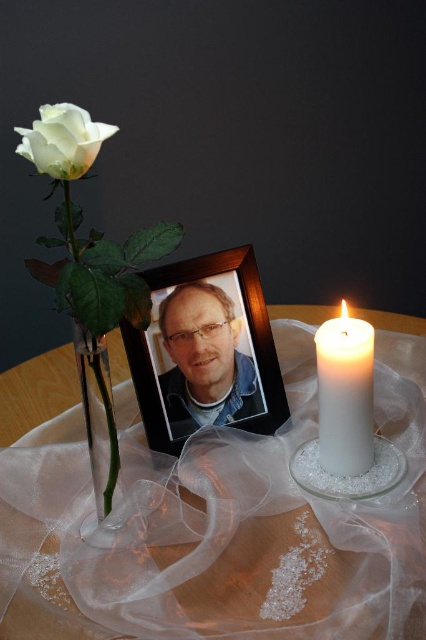
Based on the photo, which is below, white wax candle at right or clear glass vase at left?

clear glass vase at left is lower down.

Between white wax candle at right and clear glass vase at left, which one appears on the left side from the viewer's perspective?

Positioned to the left is clear glass vase at left.

Which is in front, point (330, 461) or point (118, 502)?

Point (118, 502) is in front.

What are the coordinates of `white wax candle at right` in the screenshot? It's located at (345, 394).

Between matte black photo frame at center and white wax candle at right, which one appears on the right side from the viewer's perspective?

Positioned to the right is white wax candle at right.

What do you see at coordinates (204, 360) in the screenshot? The image size is (426, 640). I see `matte black photo frame at center` at bounding box center [204, 360].

Where is `matte black photo frame at center`? The image size is (426, 640). matte black photo frame at center is located at coordinates (204, 360).

Describe the element at coordinates (100, 435) in the screenshot. I see `clear glass vase at left` at that location.

Who is shorter, clear glass vase at left or clear glass candle at center?

clear glass candle at center is shorter.

The width and height of the screenshot is (426, 640). What do you see at coordinates (100, 435) in the screenshot?
I see `clear glass vase at left` at bounding box center [100, 435].

Where is `clear glass vase at left`? clear glass vase at left is located at coordinates (100, 435).